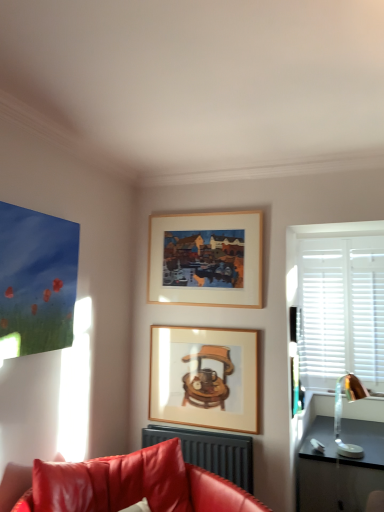
Question: Which direction should I rotate to look at wooden frame at upper center, which appears as the first picture frame when viewed from the top?

Choices:
 (A) right
 (B) left

Answer: (A)

Question: Can you confirm if leather couch at lower left is thinner than metallic gold lamp at right?

Choices:
 (A) yes
 (B) no

Answer: (B)

Question: Can you confirm if leather couch at lower left is positioned to the left of metallic gold lamp at right?

Choices:
 (A) no
 (B) yes

Answer: (B)

Question: Is leather couch at lower left oriented away from metallic gold lamp at right?

Choices:
 (A) yes
 (B) no

Answer: (B)

Question: Is leather couch at lower left located outside metallic gold lamp at right?

Choices:
 (A) yes
 (B) no

Answer: (A)

Question: Are leather couch at lower left and metallic gold lamp at right located far from each other?

Choices:
 (A) yes
 (B) no

Answer: (A)

Question: Does leather couch at lower left have a smaller size compared to metallic gold lamp at right?

Choices:
 (A) no
 (B) yes

Answer: (A)

Question: Can you confirm if matte black radiator at lower center is taller than metallic gold lamp at right?

Choices:
 (A) yes
 (B) no

Answer: (B)

Question: Can we say matte black radiator at lower center lies outside metallic gold lamp at right?

Choices:
 (A) no
 (B) yes

Answer: (B)

Question: From the image's perspective, is matte black radiator at lower center under metallic gold lamp at right?

Choices:
 (A) no
 (B) yes

Answer: (B)

Question: From a real-world perspective, is matte black radiator at lower center below metallic gold lamp at right?

Choices:
 (A) no
 (B) yes

Answer: (B)

Question: Is matte black radiator at lower center behind metallic gold lamp at right?

Choices:
 (A) no
 (B) yes

Answer: (A)

Question: Does matte black radiator at lower center appear on the right side of metallic gold lamp at right?

Choices:
 (A) yes
 (B) no

Answer: (B)

Question: Is matte black radiator at lower center positioned in front of wooden picture frame at center, the second picture frame in the top-to-bottom sequence?

Choices:
 (A) no
 (B) yes

Answer: (B)